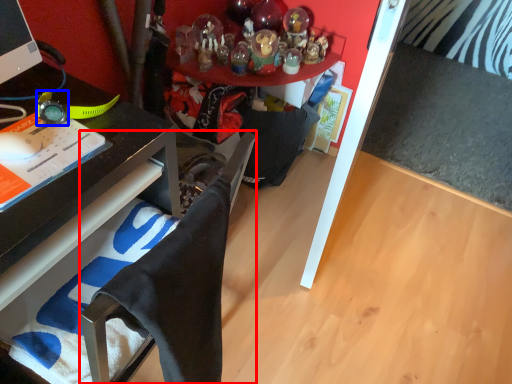
Question: Which object appears closest to the camera in this image, computer chair (highlighted by a red box) or watch (highlighted by a blue box)?

Choices:
 (A) computer chair
 (B) watch

Answer: (A)